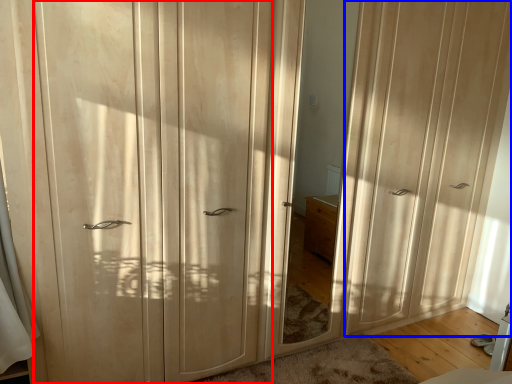
Question: Which point is further to the camera, screen door (highlighted by a red box) or screen door (highlighted by a blue box)?

Choices:
 (A) screen door
 (B) screen door

Answer: (B)